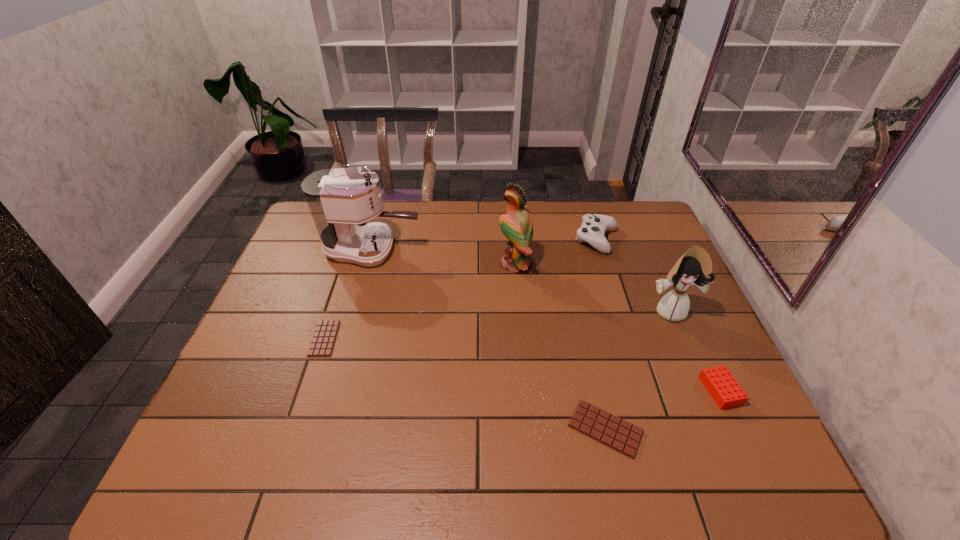
Locate an element on the screen. The width and height of the screenshot is (960, 540). the shortest object is located at coordinates (324, 337).

Find the location of a particular element. the farther candy bar is located at coordinates (324, 337).

Where is `the taller candy bar`? This screenshot has height=540, width=960. the taller candy bar is located at coordinates [x=602, y=426].

Identify the location of the right candy bar. This screenshot has height=540, width=960. pos(602,426).

You are a GUI agent. You are given a task and a screenshot of the screen. Output one action in this format:
    pyautogui.click(x=<x>, y=<y>)
    Task: Click on the control
    The height and width of the screenshot is (540, 960).
    Given the screenshot: What is the action you would take?
    pyautogui.click(x=594, y=226)

This screenshot has height=540, width=960. I want to click on parrot, so click(x=517, y=225).

I want to click on coffee maker, so click(x=341, y=201).

Locate an element on the screen. the fifth shortest object is located at coordinates (694, 268).

At what (x,y) coordinates should I click in order to perform the action: click on the fifth tallest object. Please return your answer as a coordinate pair (x, y). The image size is (960, 540). Looking at the image, I should click on (724, 389).

Where is `vacant position located 0.110m on the left of the shorter candy bar`? The width and height of the screenshot is (960, 540). vacant position located 0.110m on the left of the shorter candy bar is located at coordinates (272, 339).